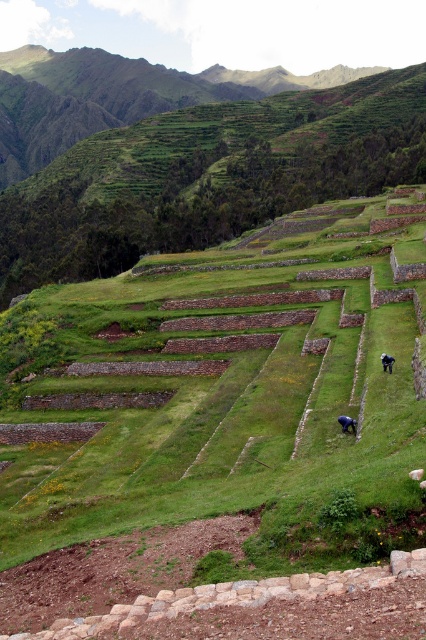
Consider the image. Does blue fabric person at lower right have a greater width compared to black fabric person at lower right?

Yes, blue fabric person at lower right is wider than black fabric person at lower right.

Can you confirm if blue fabric person at lower right is taller than black fabric person at lower right?

No, blue fabric person at lower right is not taller than black fabric person at lower right.

Between point (347, 422) and point (394, 362), which one is positioned behind?

The point (394, 362) is more distant.

You are a GUI agent. You are given a task and a screenshot of the screen. Output one action in this format:
    pyautogui.click(x=<x>, y=<y>)
    Task: Click on the blue fabric person at lower right
    The image size is (426, 640).
    Given the screenshot: What is the action you would take?
    [x=347, y=422]